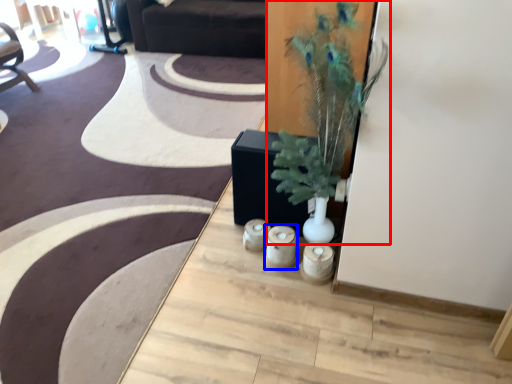
Question: Which of the following is the closest to the observer, houseplant (highlighted by a red box) or candle holder (highlighted by a blue box)?

Choices:
 (A) houseplant
 (B) candle holder

Answer: (A)